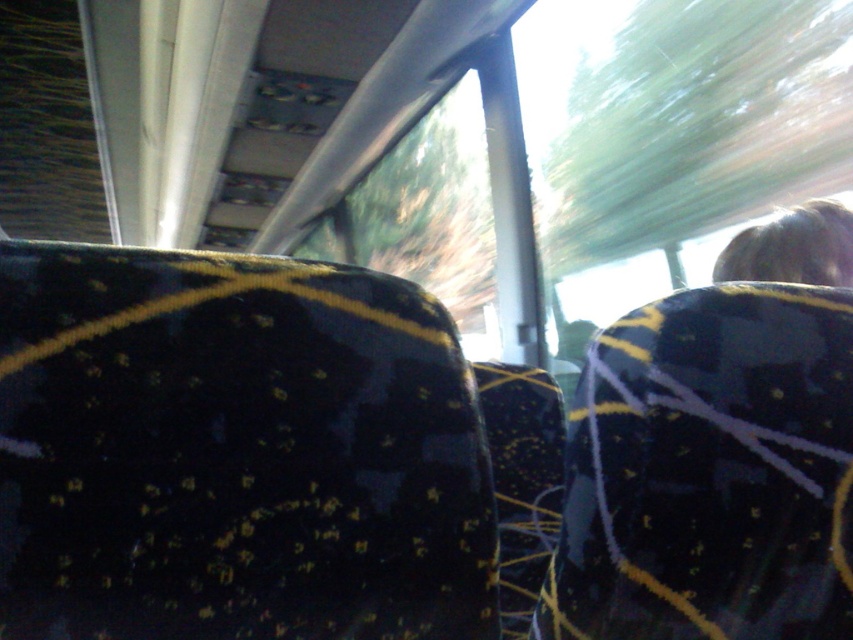
Is transparent glass window at upper center thinner than blonde hair at upper right?

Incorrect, transparent glass window at upper center's width is not less than blonde hair at upper right's.

Is transparent glass window at upper center closer to camera compared to blonde hair at upper right?

No, transparent glass window at upper center is behind blonde hair at upper right.

Consider the image. Who is more forward, (679,240) or (746,234)?

Point (746,234) is in front.

I want to click on transparent glass window at upper center, so click(x=674, y=132).

Looking at this image, between transparent glass window at center and transparent plastic window at upper left, which one has more height?

Standing taller between the two is transparent glass window at center.

Between transparent glass window at center and transparent plastic window at upper left, which one is positioned higher?

transparent plastic window at upper left is above.

The width and height of the screenshot is (853, 640). I want to click on transparent glass window at center, so click(427, 216).

Who is more forward, [740,506] or [51,97]?

Point [740,506] is more forward.

Is point (701, 468) in front of point (70, 35)?

Yes, it is in front of point (70, 35).

Between point (643, 552) and point (86, 196), which one is positioned in front?

Point (643, 552) is more forward.

Where is `velvet-like dark blue seat at right`? This screenshot has height=640, width=853. velvet-like dark blue seat at right is located at coordinates (711, 472).